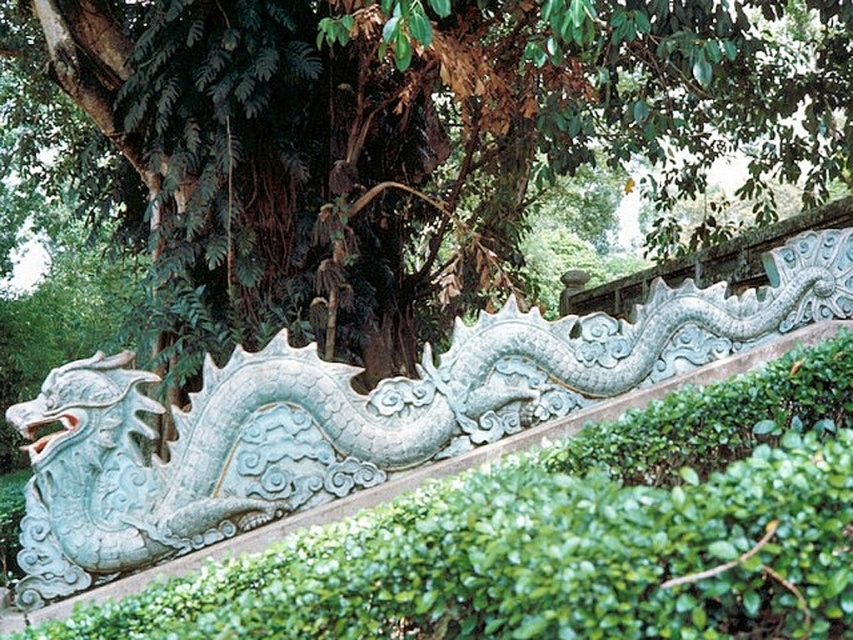
Question: Which of the following is the farthest from the observer?

Choices:
 (A) green leafy tree at center
 (B) light blue stone dragon at center

Answer: (A)

Question: Does green leafy tree at center have a larger size compared to light blue stone dragon at center?

Choices:
 (A) yes
 (B) no

Answer: (B)

Question: Which point is farther from the camera taking this photo?

Choices:
 (A) (233, 476)
 (B) (715, 76)

Answer: (B)

Question: Is green leafy tree at center smaller than light blue stone dragon at center?

Choices:
 (A) no
 (B) yes

Answer: (B)

Question: Does green leafy tree at center appear on the left side of light blue stone dragon at center?

Choices:
 (A) no
 (B) yes

Answer: (B)